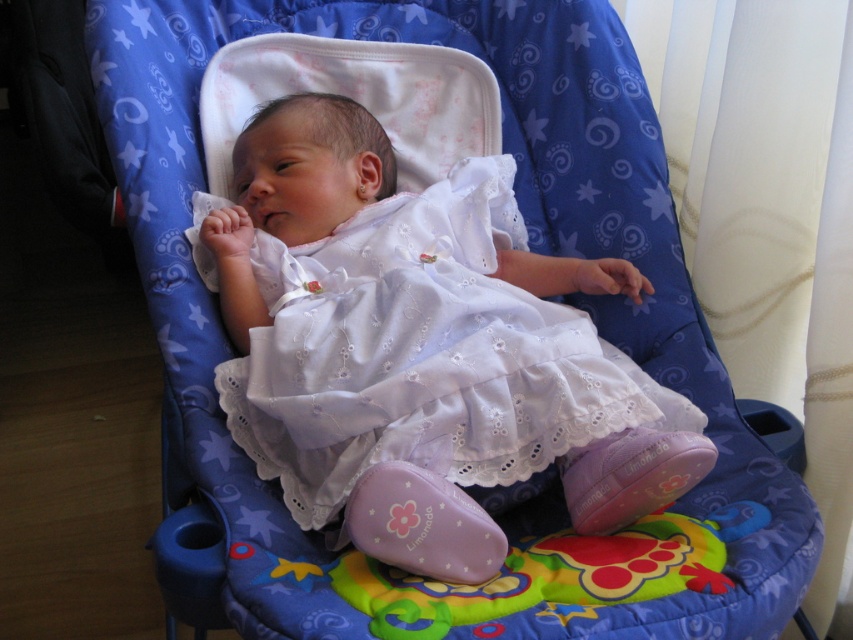
Is point (352, 340) more distant than point (360, 186)?

No, it is not.

Is white lace dress at center below silver metallic teething ring at ear?

Correct, white lace dress at center is located below silver metallic teething ring at ear.

I want to click on white lace dress at center, so click(x=422, y=349).